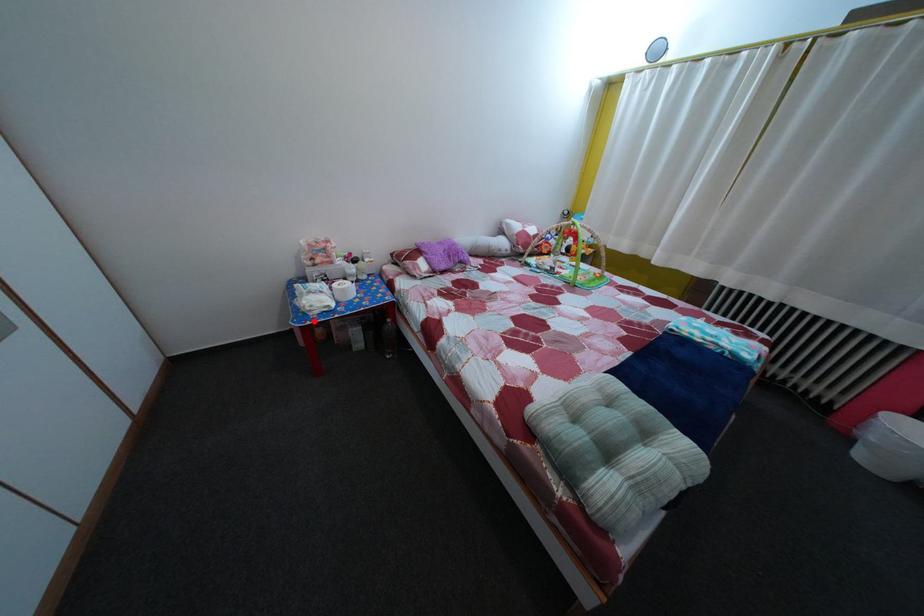
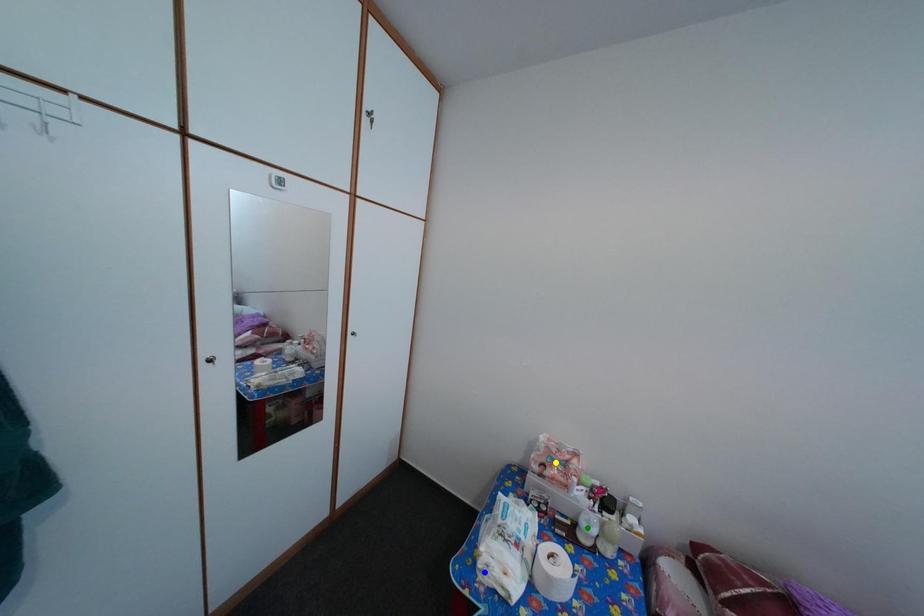
Question: I am providing you with two images of the same scene from different viewpoints. A red point is marked on the first image. You are given multiple points on the second image. Can you choose the point in image 2 that corresponds to the point in image 1?

Choices:
 (A) green point
 (B) yellow point
 (C) blue point

Answer: (C)